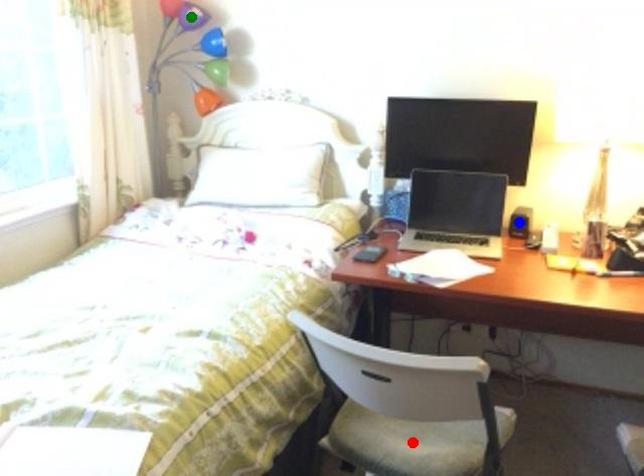
Looking at this image, order these from farthest to nearest:
red point, blue point, green point

1. green point
2. blue point
3. red point